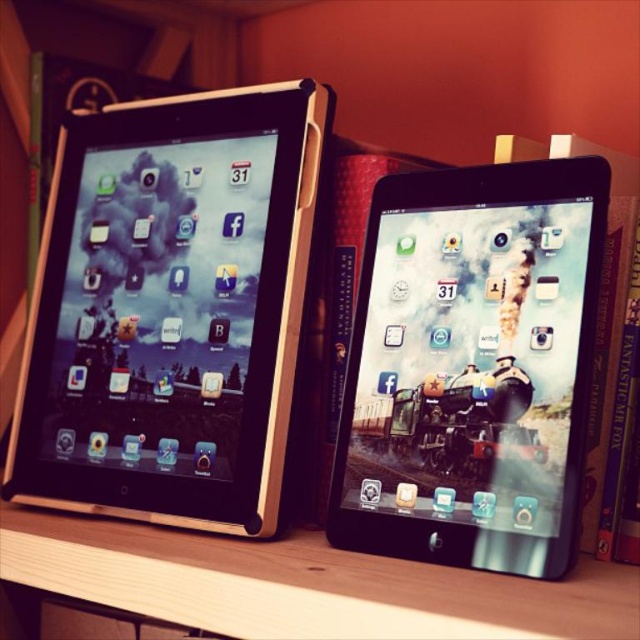
Consider the image. Which of these two, matte black tablet at left or satin black tablet at center, stands taller?

With more height is matte black tablet at left.

Looking at this image, can you confirm if matte black tablet at left is thinner than satin black tablet at center?

No.

Is point (264, 342) positioned after point (506, 400)?

Yes, point (264, 342) is farther from viewer.

This screenshot has width=640, height=640. What are the coordinates of `matte black tablet at left` in the screenshot? It's located at (170, 308).